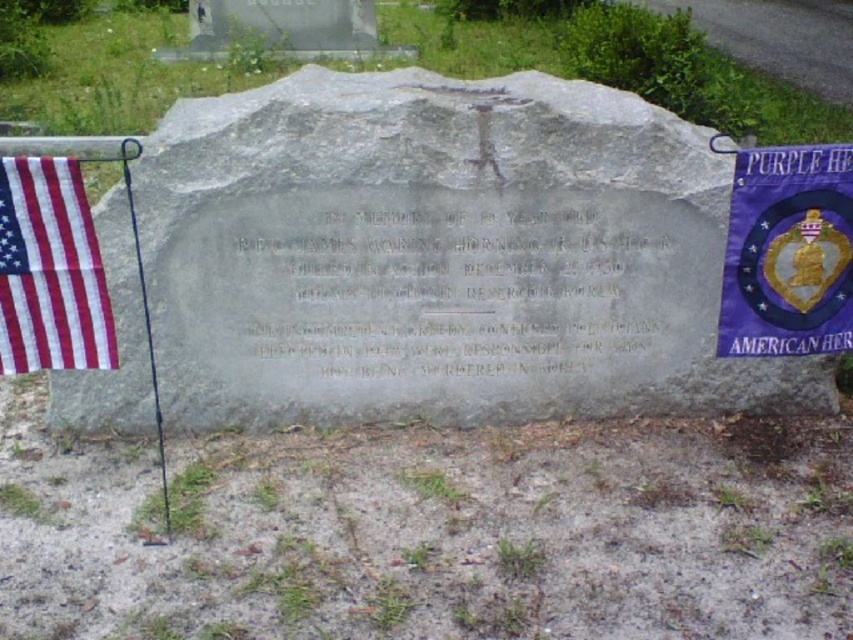
You are standing in front of the memorial stone and want to take a photo. You notice two points on the stone marked as point 1 and point 2. Point 1 is at coordinate (x=833, y=348) and point 2 is at coordinate (x=39, y=353). Which point is closer to your camera lens when taking the photo?

Point 1 at coordinate (x=833, y=348) is closer to the camera lens than point 2 at coordinate (x=39, y=353) because it is further to the camera.

You are a maintenance worker tasked with placing a new 50 cm wide decorative plaque between the gray stone at center and the purple fabric banner at upper right. Can you fit it there without overlapping either object?

The distance between the gray stone at center and the purple fabric banner at upper right is 47.10 centimeters. Since the plaque is 50 cm wide, it cannot fit between them without overlapping either object.